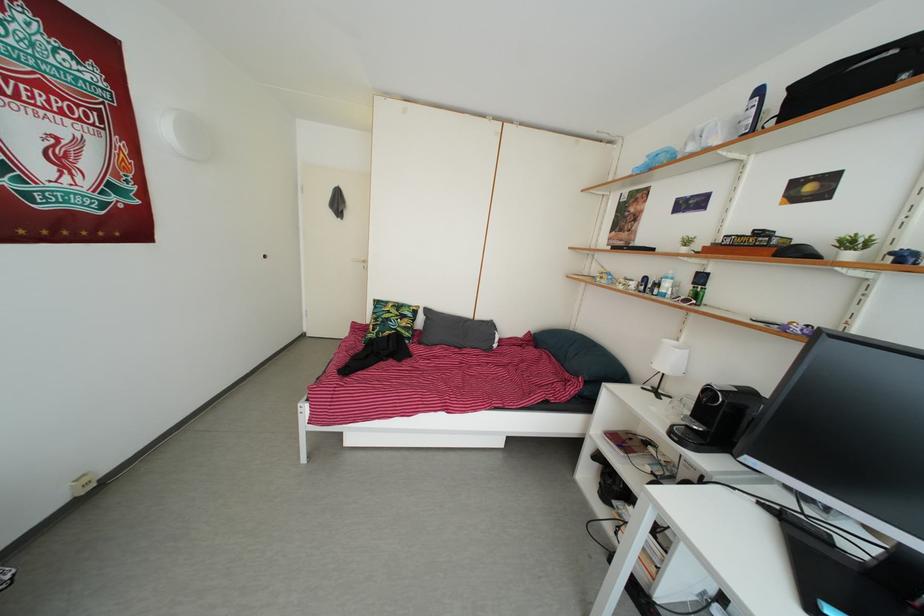
This screenshot has height=616, width=924. I want to click on grey pillow, so click(x=456, y=331).